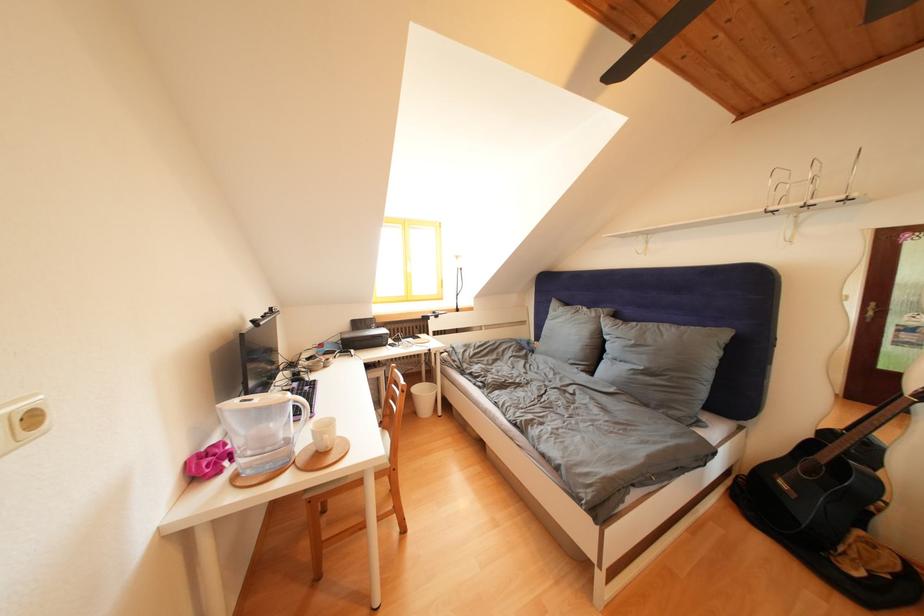
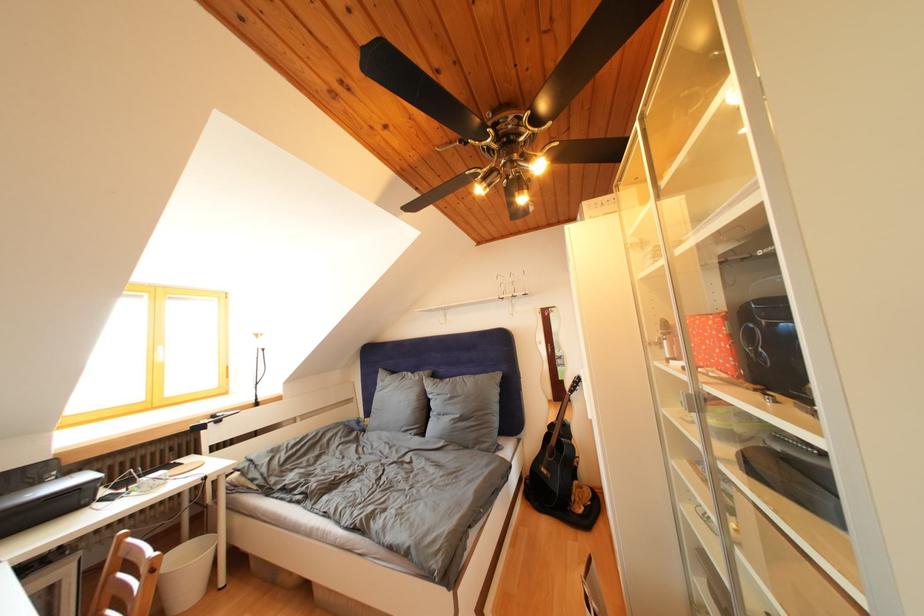
Find the pixel in the second image that matches pixel 378 333 in the first image.

(44, 488)